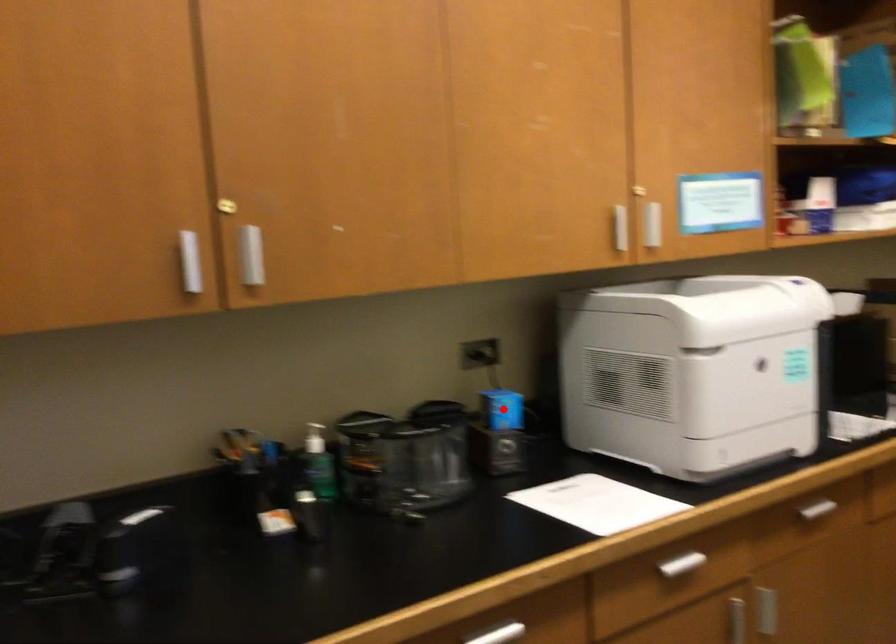
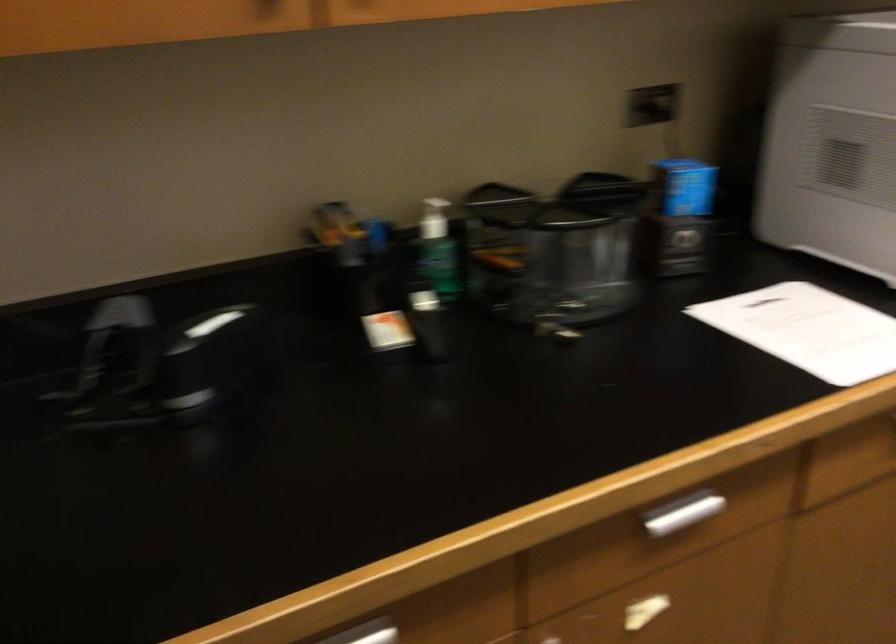
Where in the second image is the point corresponding to the highlighted location from the first image?

(684, 187)